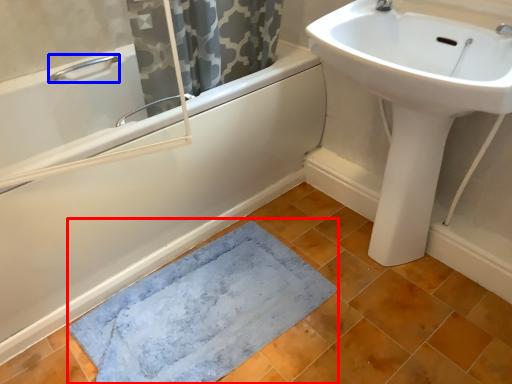
Question: Which of the following is the farthest to the observer, bath mat (highlighted by a red box) or plumbing fixture (highlighted by a blue box)?

Choices:
 (A) bath mat
 (B) plumbing fixture

Answer: (B)